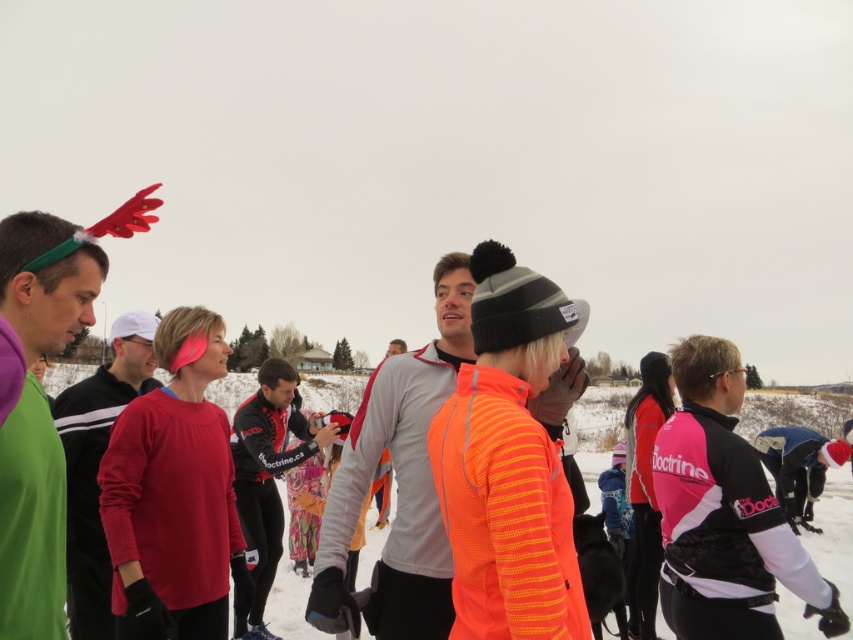
Question: Does gray fleece jacket at center appear on the left side of matte red sweater at center?

Choices:
 (A) no
 (B) yes

Answer: (A)

Question: Which point is closer to the camera?

Choices:
 (A) orange fleece jacket at center
 (B) matte red sweater at center
 (C) green matte headband at left

Answer: (C)

Question: Can you confirm if green matte headband at left is smaller than matte red sweater at center?

Choices:
 (A) yes
 (B) no

Answer: (A)

Question: Which point appears farthest from the camera in this image?

Choices:
 (A) (660, 602)
 (B) (45, 620)
 (C) (84, 524)
 (D) (281, 371)

Answer: (D)

Question: Based on their relative distances, which object is farther from the orange fleece jacket at center?

Choices:
 (A) neon orange knit sweater at center
 (B) matte red sweater at center
 (C) pink/white/synthetic jacket at right

Answer: (C)

Question: Is pink/white/synthetic jacket at right thinner than orange fleece jacket at center?

Choices:
 (A) no
 (B) yes

Answer: (B)